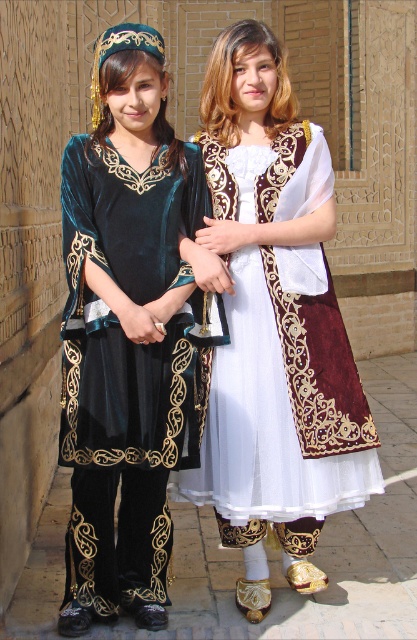
You are a photographer setting up a shot of the two individuals in the scene. You need to position a light source so that it illuminates both points marked as point (65, 355) and point (250, 493) equally. Given their positions relative to the camera, which point should you adjust the light intensity for to ensure even illumination?

Point (250, 493) is farther from the camera than point (65, 355). To ensure equal illumination, you should increase the light intensity for point (250, 493) since it is farther away and might require more light to appear equally bright.

You are an artist sketching the scene and want to place the velvet teal dress at center accurately. According to the coordinates provided, where should you position it on your canvas?

The velvet teal dress at center should be positioned at the coordinates point 0.522 on the x axis and 0.307 on the y axis.